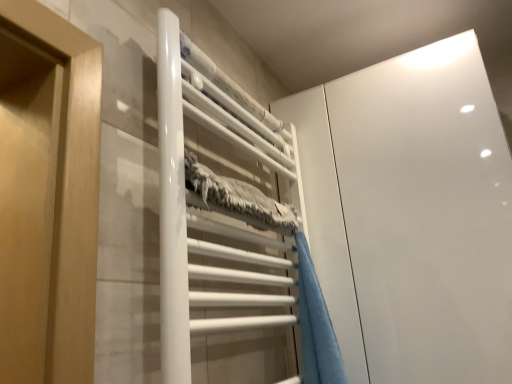
Question: Does point (429, 369) appear closer or farther from the camera than point (239, 137)?

Choices:
 (A) closer
 (B) farther

Answer: (B)

Question: Is white glossy cabinet at upper right spatially inside white glossy towel rack at center, or outside of it?

Choices:
 (A) inside
 (B) outside

Answer: (B)

Question: Estimate the real-world distances between objects in this image. Which object is closer to the white glossy towel rack at center?

Choices:
 (A) white glossy cabinet at upper right
 (B) blue plush towel at center

Answer: (B)

Question: Which is farther from the white glossy cabinet at upper right?

Choices:
 (A) blue plush towel at center
 (B) white glossy towel rack at center

Answer: (B)